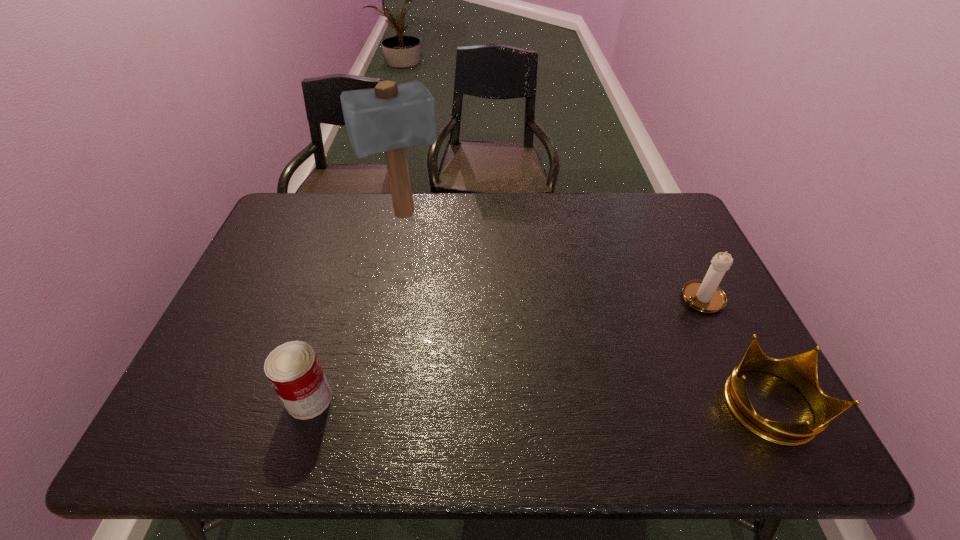
I want to click on vacant space on the desktop that is between the can and the crown and is positioned on the striking surface of the farthest object, so click(x=488, y=402).

This screenshot has height=540, width=960. Find the location of `vacant space on the desktop that is between the can and the shortest object and is positioned on the handle side of the candle holder`. vacant space on the desktop that is between the can and the shortest object and is positioned on the handle side of the candle holder is located at coordinates (539, 402).